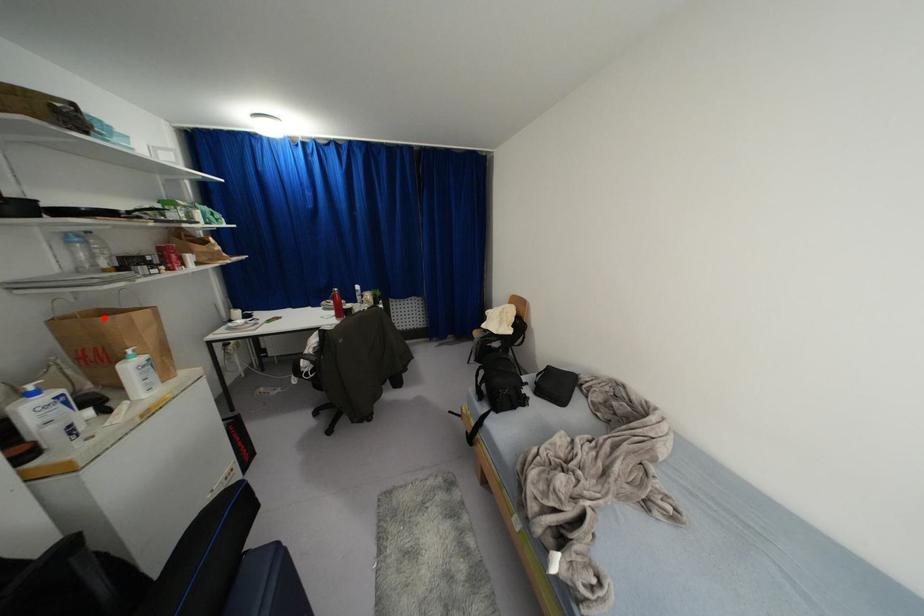
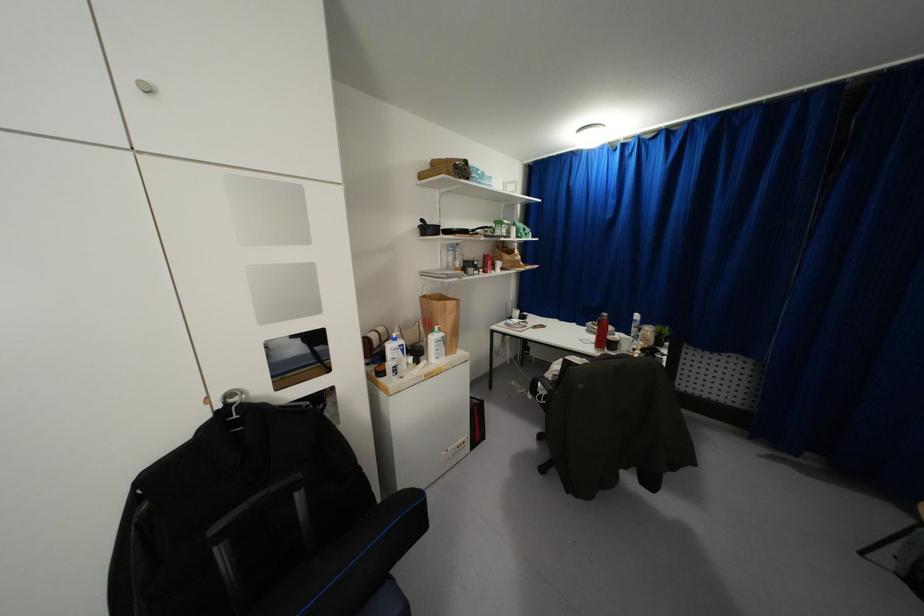
The point at the highlighted location is marked in the first image. Where is the corresponding point in the second image?

(434, 302)